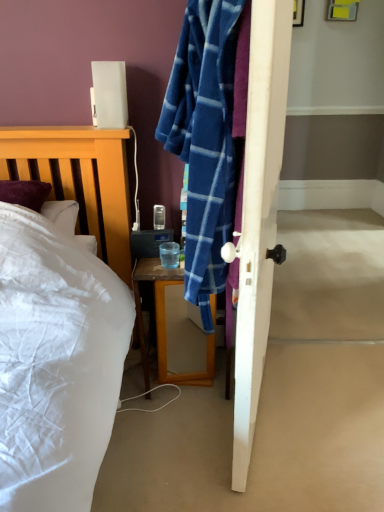
Question: Considering the relative positions of transparent glass at bedside and yellow plastic picture frame at upper right in the image provided, is transparent glass at bedside to the left of yellow plastic picture frame at upper right from the viewer's perspective?

Choices:
 (A) no
 (B) yes

Answer: (B)

Question: Is transparent glass at bedside outside yellow plastic picture frame at upper right?

Choices:
 (A) no
 (B) yes

Answer: (B)

Question: Considering the relative sizes of transparent glass at bedside and yellow plastic picture frame at upper right in the image provided, is transparent glass at bedside thinner than yellow plastic picture frame at upper right?

Choices:
 (A) no
 (B) yes

Answer: (A)

Question: Can you confirm if transparent glass at bedside is taller than yellow plastic picture frame at upper right?

Choices:
 (A) no
 (B) yes

Answer: (A)

Question: Is transparent glass at bedside positioned far away from yellow plastic picture frame at upper right?

Choices:
 (A) no
 (B) yes

Answer: (B)

Question: Is transparent glass at bedside in front of yellow plastic picture frame at upper right?

Choices:
 (A) yes
 (B) no

Answer: (A)

Question: Is satin white lamp at upper left turned away from wooden desk at center?

Choices:
 (A) no
 (B) yes

Answer: (A)

Question: Is satin white lamp at upper left behind wooden desk at center?

Choices:
 (A) no
 (B) yes

Answer: (A)

Question: Can we say satin white lamp at upper left lies outside wooden desk at center?

Choices:
 (A) yes
 (B) no

Answer: (A)

Question: Does satin white lamp at upper left have a lesser height compared to wooden desk at center?

Choices:
 (A) no
 (B) yes

Answer: (B)

Question: Is satin white lamp at upper left beside wooden desk at center?

Choices:
 (A) yes
 (B) no

Answer: (B)

Question: Does satin white lamp at upper left have a smaller size compared to wooden desk at center?

Choices:
 (A) yes
 (B) no

Answer: (A)

Question: From the image's perspective, is wooden desk at center below transparent glass at bedside?

Choices:
 (A) no
 (B) yes

Answer: (B)